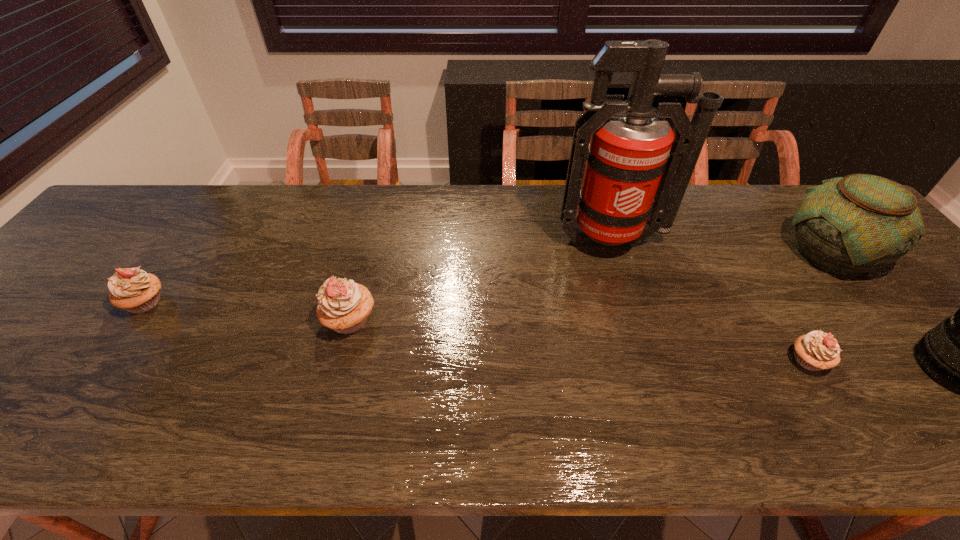
At what (x,y) coordinates should I click in order to perform the action: click on free space for an extra cupcake to achieve even spacing. Please return your answer as a coordinate pair (x, y). Looking at the image, I should click on (570, 340).